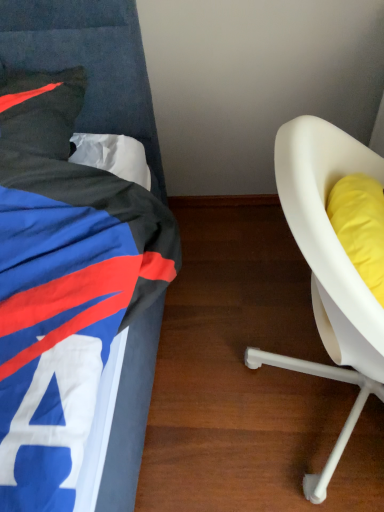
What do you see at coordinates (328, 269) in the screenshot? I see `white plastic chair at right` at bounding box center [328, 269].

Measure the distance between white plastic chair at right and camera.

white plastic chair at right is 19.41 inches away from camera.

Locate an element on the screen. white plastic chair at right is located at coordinates (328, 269).

What are the coordinates of `white plastic chair at right` in the screenshot? It's located at (328, 269).